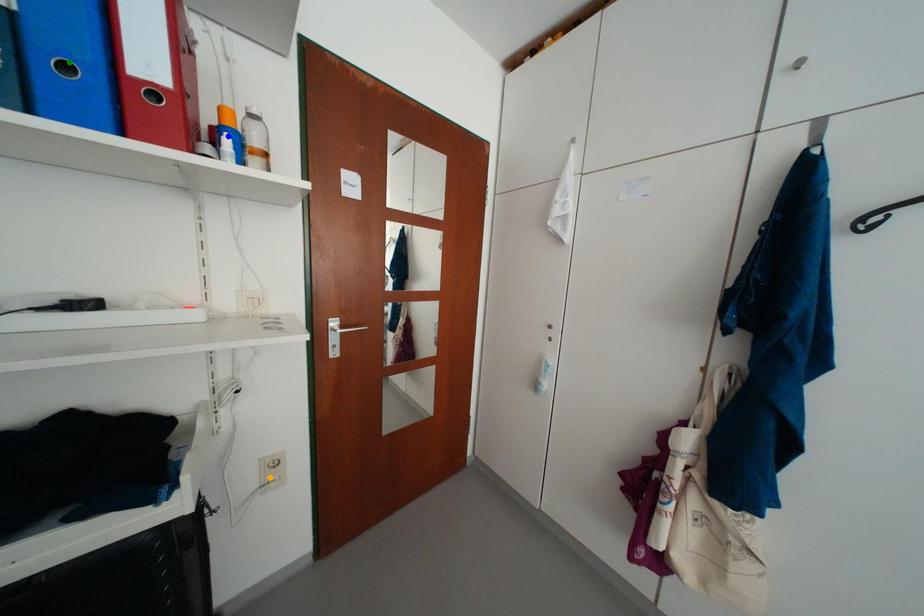
Order these from nearest to farthest:
1. orange point
2. blue point
3. green point

green point
blue point
orange point